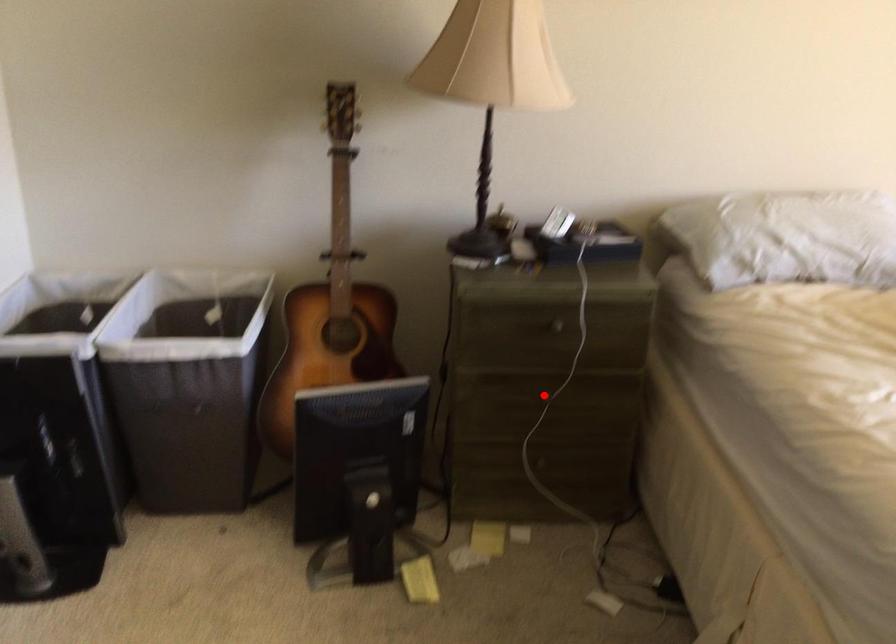
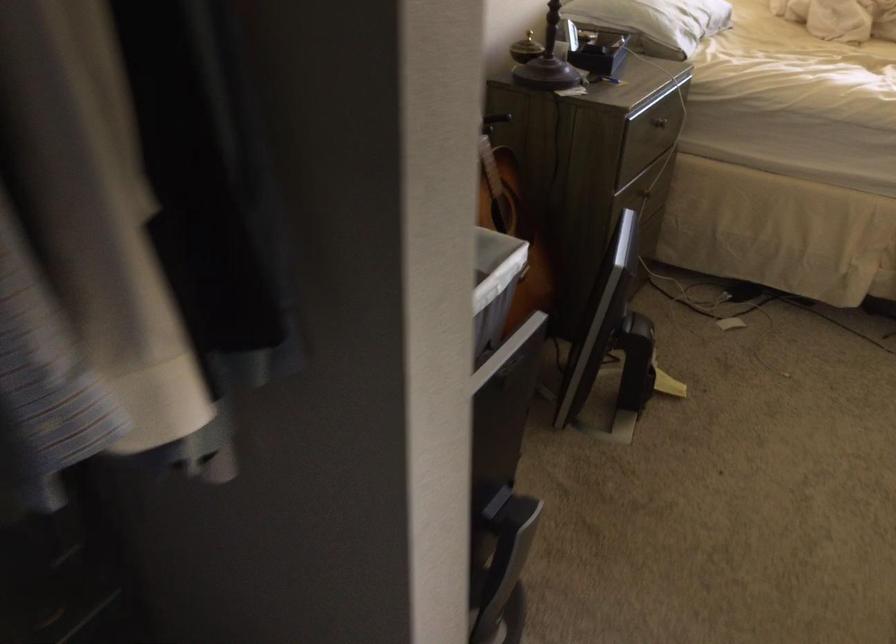
Locate, in the second image, the point that corresponds to the highlighted location in the first image.

(645, 194)